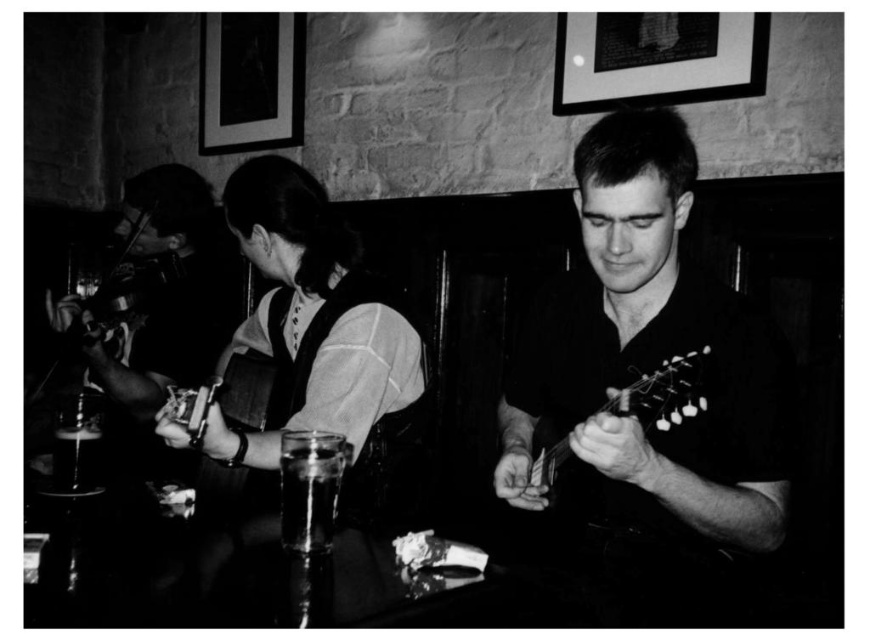
Is clear glass at center further to the viewer compared to metallic silver guitar at center?

Yes, it is.

Does clear glass at center appear over metallic silver guitar at center?

No.

The width and height of the screenshot is (870, 640). Identify the location of clear glass at center. (310, 488).

You are a GUI agent. You are given a task and a screenshot of the screen. Output one action in this format:
    pyautogui.click(x=<x>, y=<y>)
    Task: Click on the clear glass at center
    The width and height of the screenshot is (870, 640).
    Given the screenshot: What is the action you would take?
    pyautogui.click(x=310, y=488)

Does black matte guitar at center have a lesser height compared to translucent glass at lower left?

No, black matte guitar at center is not shorter than translucent glass at lower left.

Is black matte guitar at center to the right of translucent glass at lower left from the viewer's perspective?

Indeed, black matte guitar at center is positioned on the right side of translucent glass at lower left.

Who is more forward, (594, 204) or (74, 481)?

Positioned in front is point (594, 204).

At what (x,y) coordinates should I click in order to perform the action: click on black matte guitar at center. Please return your answer as a coordinate pair (x, y). Looking at the image, I should click on (648, 372).

Is point (725, 502) less distant than point (648, 422)?

That is True.

Who is more distant from viewer, (661, 531) or (546, 490)?

The point (661, 531) is behind.

Is point (681, 348) farther from viewer compared to point (696, 374)?

Yes, point (681, 348) is behind point (696, 374).

The width and height of the screenshot is (870, 640). What are the coordinates of `black matte guitar at center` in the screenshot? It's located at (648, 372).